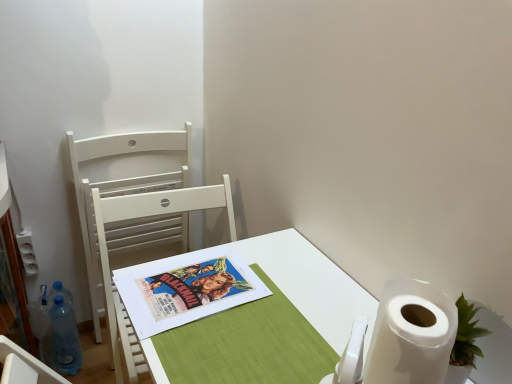
At what (x,y) coordinates should I click in order to perform the action: click on empty space that is ontop of colorful paper poster at center (from a real-world perspective). Please return your answer as a coordinate pair (x, y). This screenshot has height=384, width=512. Looking at the image, I should click on (191, 284).